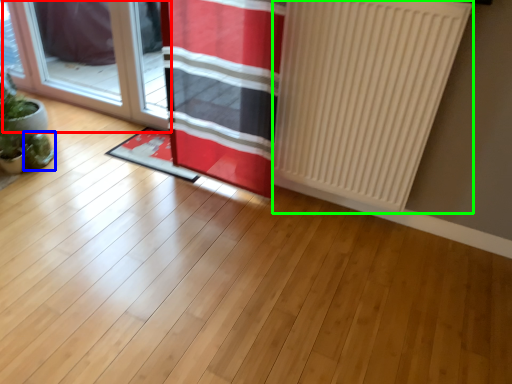
Question: Considering the real-world distances, which object is farthest from door (highlighted by a red box)? plant (highlighted by a blue box) or radiator (highlighted by a green box)?

Choices:
 (A) plant
 (B) radiator

Answer: (B)